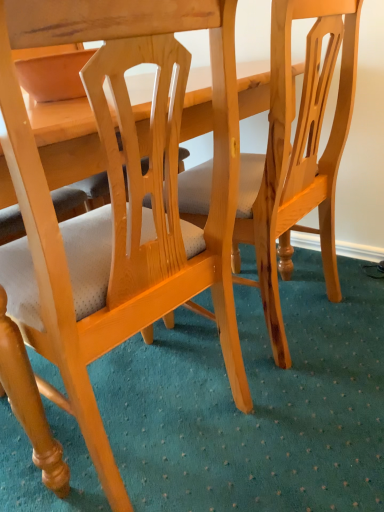
This screenshot has height=512, width=384. I want to click on free space underneath light brown wood chair at center, which is counted as the second chair, starting from the left (from a real-world perspective), so click(303, 320).